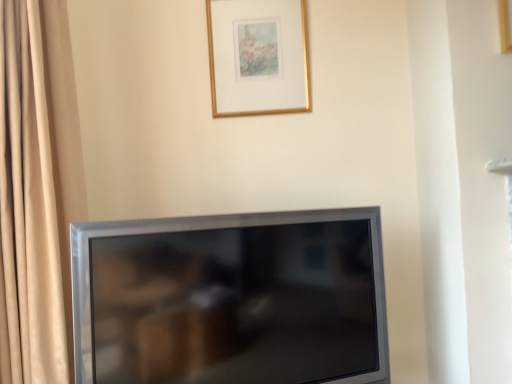
Question: Is satin silver tv at lower center positioned before gold metallic picture frame at upper center?

Choices:
 (A) yes
 (B) no

Answer: (A)

Question: Is satin silver tv at lower center aimed at gold metallic picture frame at upper center?

Choices:
 (A) no
 (B) yes

Answer: (A)

Question: Considering the relative positions of satin silver tv at lower center and gold metallic picture frame at upper center in the image provided, is satin silver tv at lower center to the left of gold metallic picture frame at upper center from the viewer's perspective?

Choices:
 (A) no
 (B) yes

Answer: (B)

Question: From a real-world perspective, is satin silver tv at lower center located beneath gold metallic picture frame at upper center?

Choices:
 (A) no
 (B) yes

Answer: (B)

Question: Is satin silver tv at lower center turned away from gold metallic picture frame at upper center?

Choices:
 (A) no
 (B) yes

Answer: (A)

Question: Is satin silver tv at lower center not within gold metallic picture frame at upper center?

Choices:
 (A) yes
 (B) no

Answer: (A)

Question: Is gold metallic picture frame at upper center positioned in front of satin silver tv at lower center?

Choices:
 (A) no
 (B) yes

Answer: (A)

Question: Does gold metallic picture frame at upper center have a lesser width compared to satin silver tv at lower center?

Choices:
 (A) no
 (B) yes

Answer: (B)

Question: Considering the relative sizes of gold metallic picture frame at upper center and satin silver tv at lower center in the image provided, is gold metallic picture frame at upper center bigger than satin silver tv at lower center?

Choices:
 (A) no
 (B) yes

Answer: (A)

Question: Is gold metallic picture frame at upper center taller than satin silver tv at lower center?

Choices:
 (A) no
 (B) yes

Answer: (A)

Question: From a real-world perspective, does gold metallic picture frame at upper center sit lower than satin silver tv at lower center?

Choices:
 (A) yes
 (B) no

Answer: (B)

Question: Can you confirm if gold metallic picture frame at upper center is shorter than satin silver tv at lower center?

Choices:
 (A) yes
 (B) no

Answer: (A)

Question: Do you think satin silver tv at lower center is within gold metallic picture frame at upper center, or outside of it?

Choices:
 (A) inside
 (B) outside

Answer: (B)